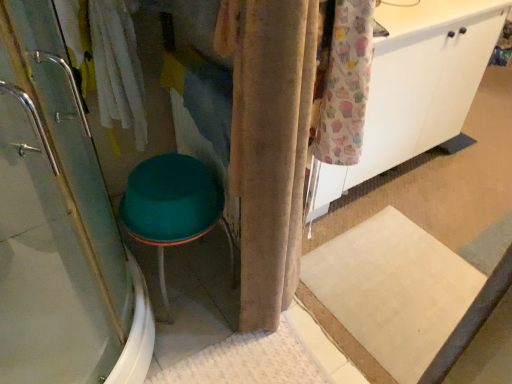
This screenshot has height=384, width=512. I want to click on free point to the right of velvet beige curtain at center, so click(297, 316).